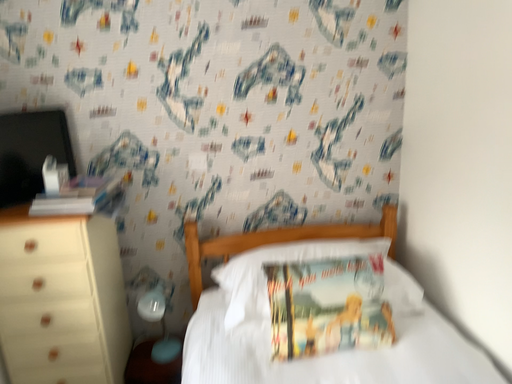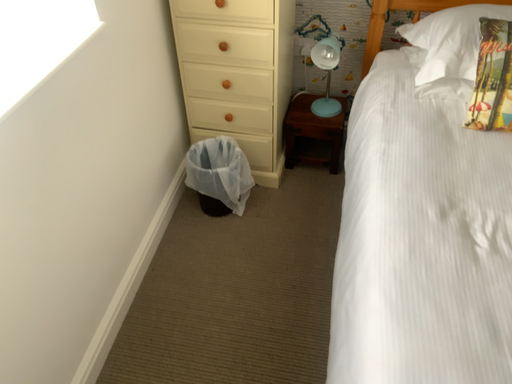
Question: How did the camera likely rotate when shooting the video?

Choices:
 (A) rotated left
 (B) rotated right

Answer: (A)